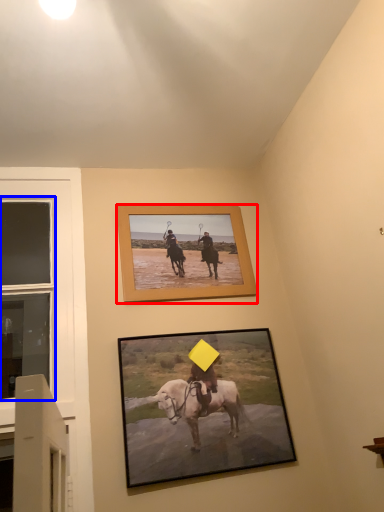
Question: Which object appears closest to the camera in this image, picture frame (highlighted by a red box) or window (highlighted by a blue box)?

Choices:
 (A) picture frame
 (B) window

Answer: (B)